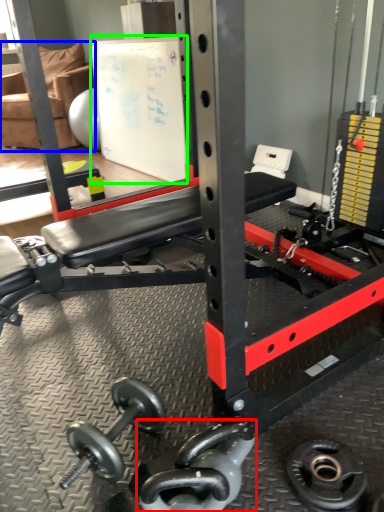
Question: Which object is positioned closest to dumbbell (highlighted by a red box)? Select from chair (highlighted by a blue box) and bulletin board (highlighted by a green box).

Choices:
 (A) chair
 (B) bulletin board

Answer: (B)